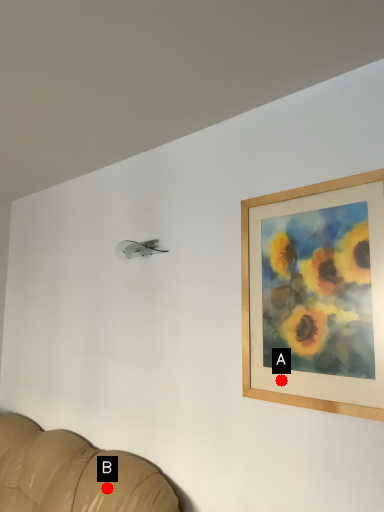
Question: Two points are circled on the image, labeled by A and B beside each circle. Which of the following is the farthest from the observer?

Choices:
 (A) A is further
 (B) B is further

Answer: (B)